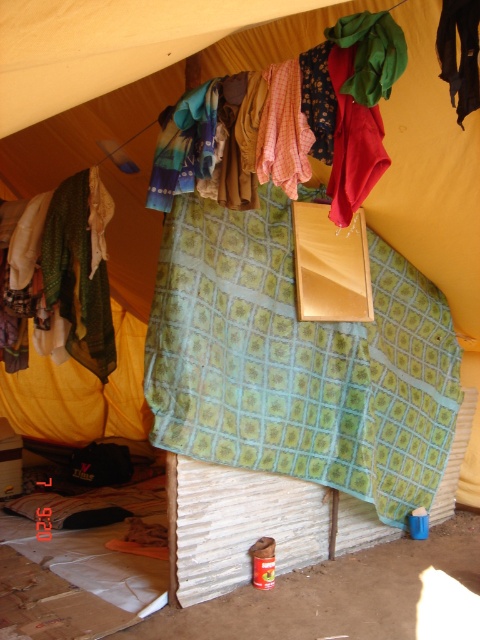
You are standing at the entrance of the tent and want to take a photo of the green patterned fabric at center. If your camera has a maximum focus range of 8 feet, will you be able to capture the fabric clearly?

The green patterned fabric at center and camera are 8.76 feet apart from each other. Since the camera can only focus up to 8 feet, it won

Based on the photo, you are inside the tent and want to reach both the green fabric at left and the red cotton cloth at center. Which one will you need to stretch your arm further to touch?

You will need to stretch your arm further to touch the red cotton cloth at center because it is farther away from you compared to the green fabric at left, which is closer.